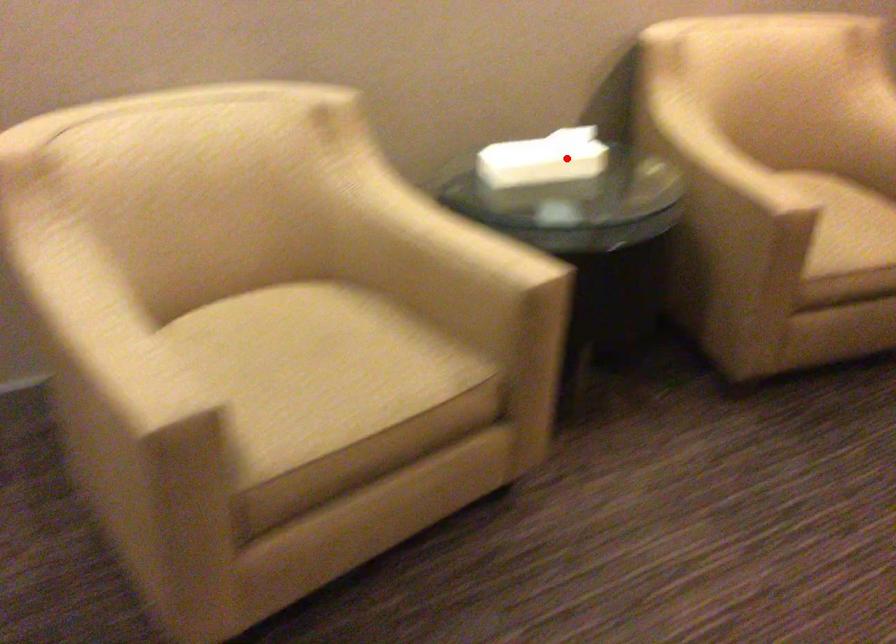
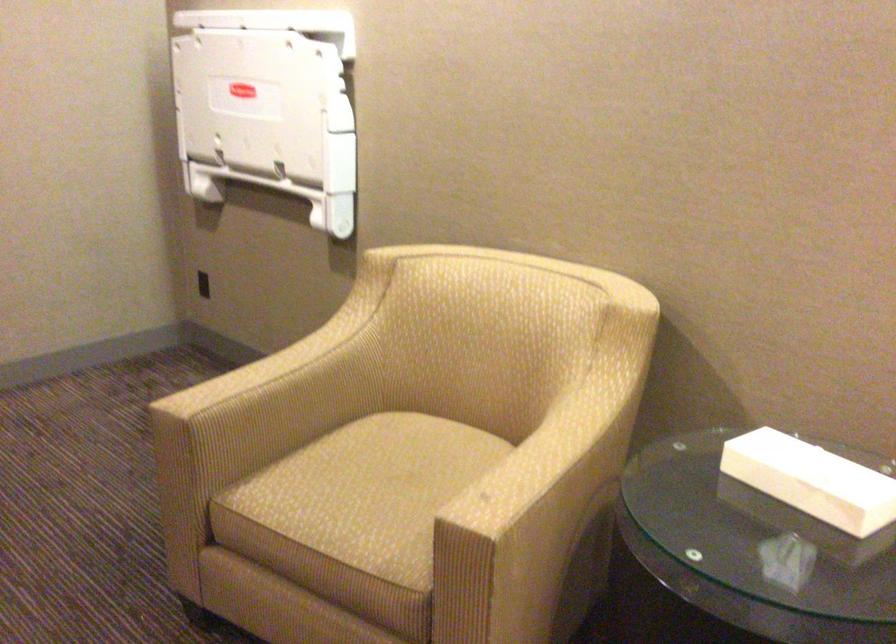
Question: I am providing you with two images of the same scene from different viewpoints. Image1 has a red point marked. In image2, the corresponding 3D location appears at what relative position? Reply with the corresponding letter.

Choices:
 (A) Closer
 (B) Farther

Answer: (A)